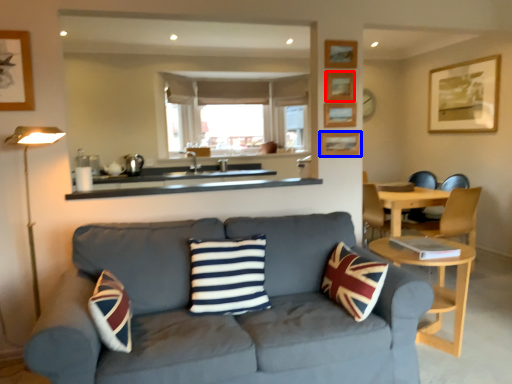
Question: Which object is further to the camera taking this photo, picture frame (highlighted by a red box) or picture frame (highlighted by a blue box)?

Choices:
 (A) picture frame
 (B) picture frame

Answer: (B)